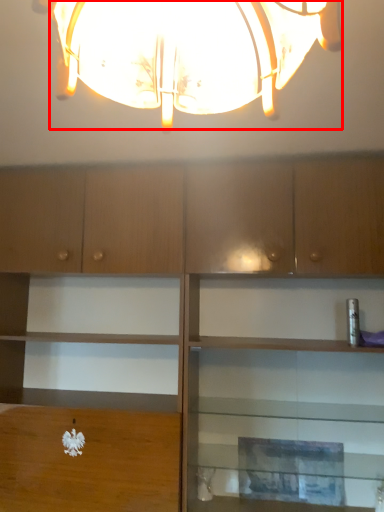
Question: Where is lamp (annotated by the red box) located in relation to cabinetry in the image?

Choices:
 (A) left
 (B) right

Answer: (A)